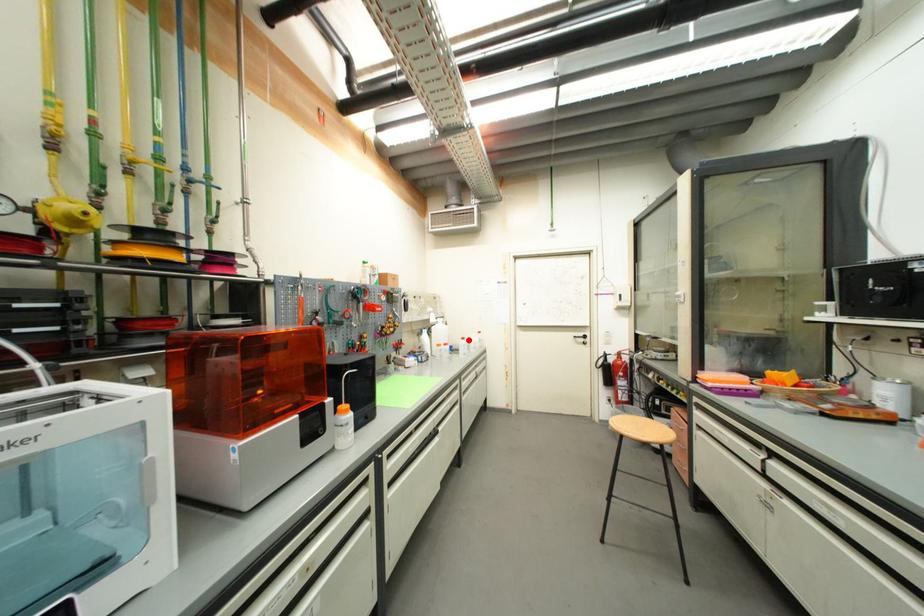
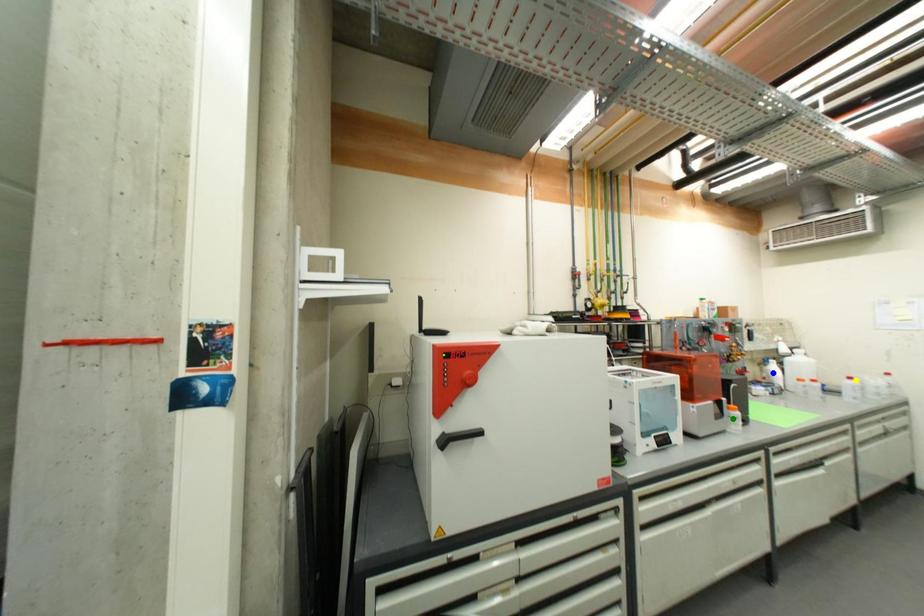
Question: I am providing you with two images of the same scene from different viewpoints. A red point is marked on the first image. You are given multiple points on the second image. Which point in image 2 represents the same 3d spot as the red point in image 1?

Choices:
 (A) yellow point
 (B) green point
 (C) blue point

Answer: (A)